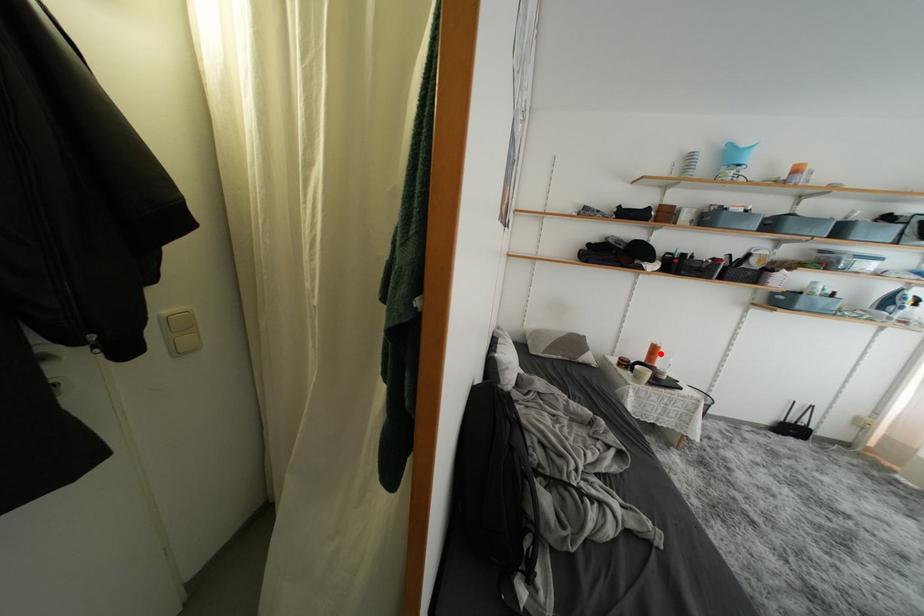
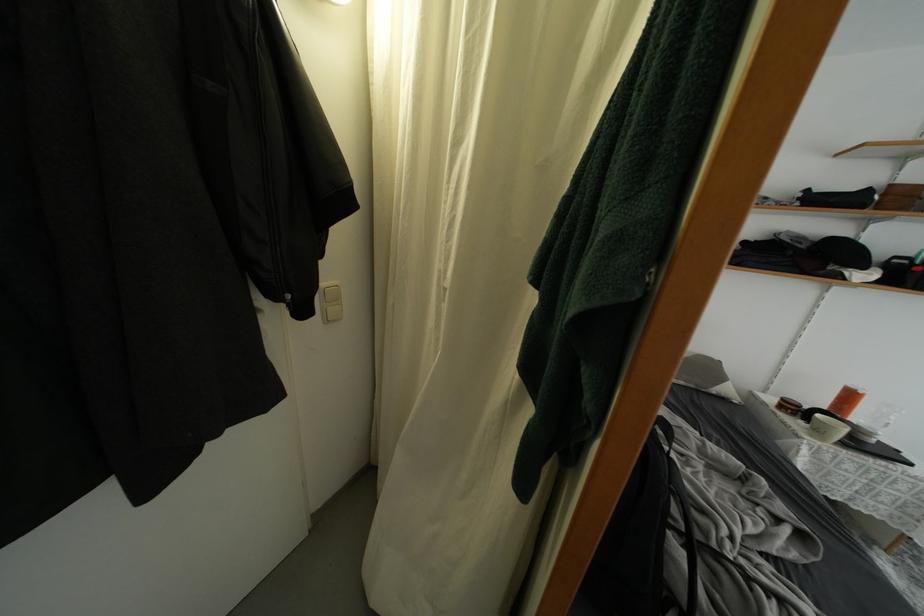
Find the pixel in the second image that matches the highlighted location in the first image.

(856, 400)